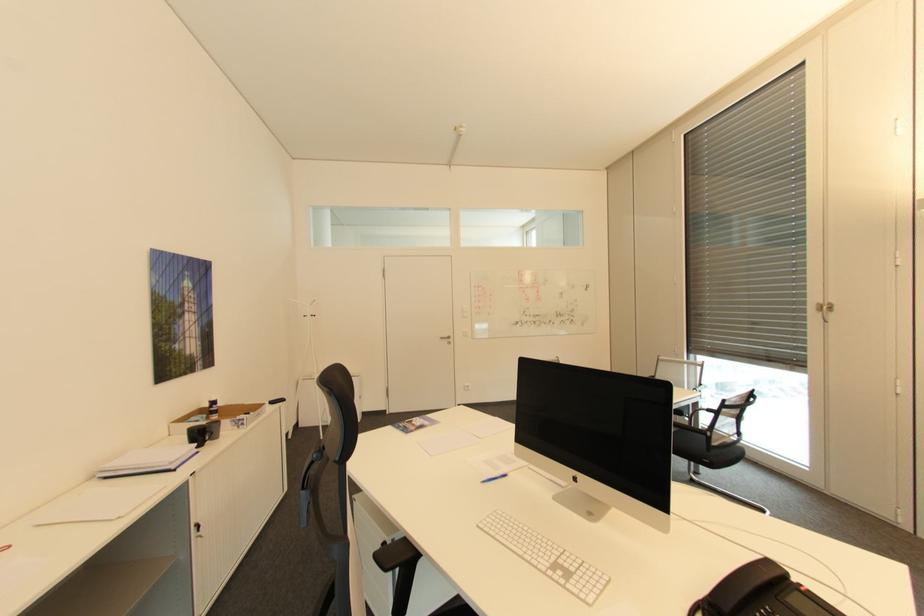
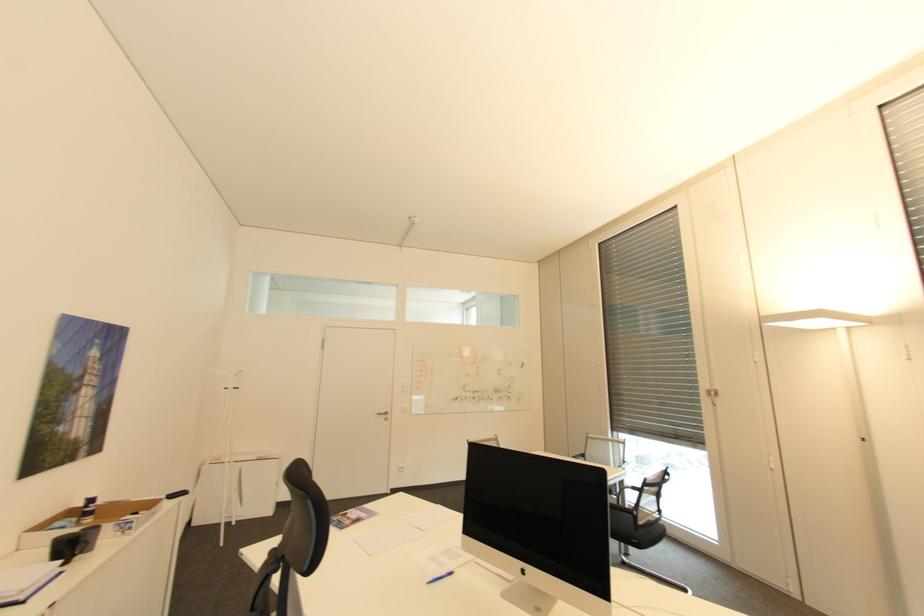
Find the pixel in the second image that matches pixel 454 337 in the first image.

(391, 413)